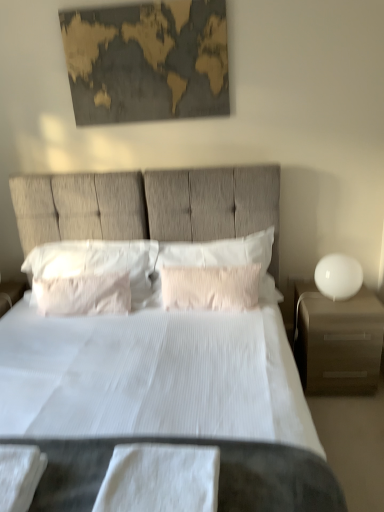
Find the location of `vacant space situated above gold textured map at upper center (from a real-world perspective)`. vacant space situated above gold textured map at upper center (from a real-world perspective) is located at coordinates (109, 2).